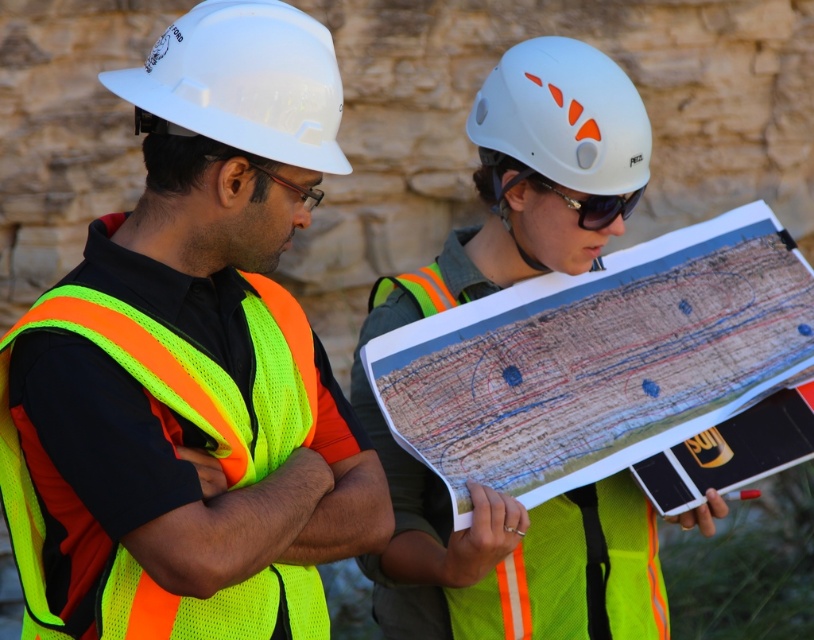
Question: Observing the image, what is the correct spatial positioning of neon yellow reflective vest at center in reference to sunglasses at center?

Choices:
 (A) above
 (B) below

Answer: (B)

Question: Among these points, which one is farthest from the camera?

Choices:
 (A) (418, 508)
 (B) (578, 200)
 (C) (257, 90)

Answer: (A)

Question: Which of the following is the farthest from the observer?

Choices:
 (A) sunglasses at center
 (B) neon yellow mesh safety vest at left

Answer: (A)

Question: Where is neon yellow mesh safety vest at left located in relation to white matte helmet at upper center in the image?

Choices:
 (A) above
 (B) below

Answer: (B)

Question: Is white matte helmet at upper center wider than sunglasses at center?

Choices:
 (A) yes
 (B) no

Answer: (A)

Question: Which object is closer to the camera taking this photo?

Choices:
 (A) neon yellow mesh safety vest at left
 (B) neon yellow reflective vest at center
 (C) sunglasses at center
 (D) white matte helmet at upper center

Answer: (B)